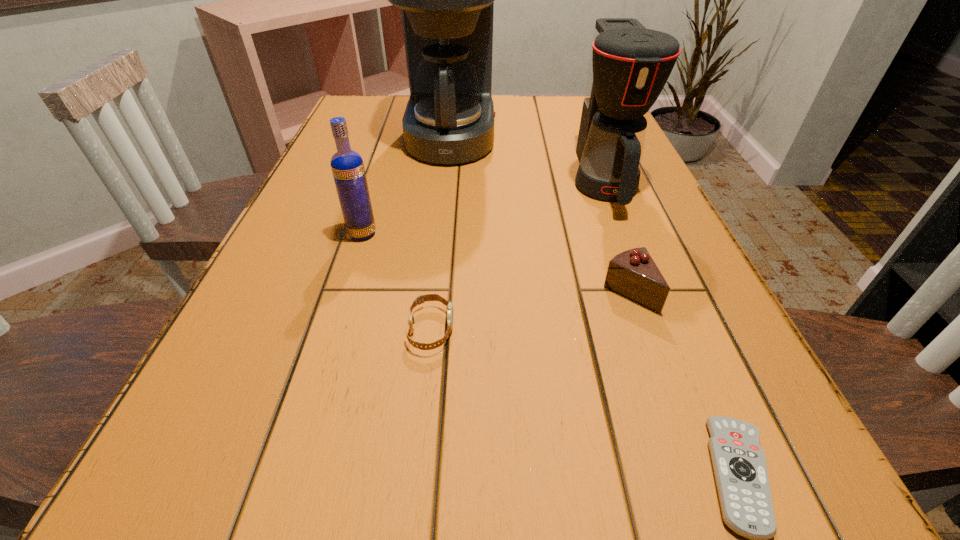
You are a GUI agent. You are given a task and a screenshot of the screen. Output one action in this format:
    pyautogui.click(x=<x>, y=<y>)
    Task: Click on the object that is the second closest to the left coffee maker
    
    Given the screenshot: What is the action you would take?
    pyautogui.click(x=347, y=166)

This screenshot has width=960, height=540. Identify the location of free space that satisfies the following two spatial constraints: 1. pour from the carafe of the shorter coffee maker; 2. on the face of the fifth tallest object. (662, 329).

Where is `blank area in the image that satisfies the following two spatial constraints: 1. on the button side of the left coffee maker; 2. on the left side of the fourth tallest object`? blank area in the image that satisfies the following two spatial constraints: 1. on the button side of the left coffee maker; 2. on the left side of the fourth tallest object is located at coordinates (436, 292).